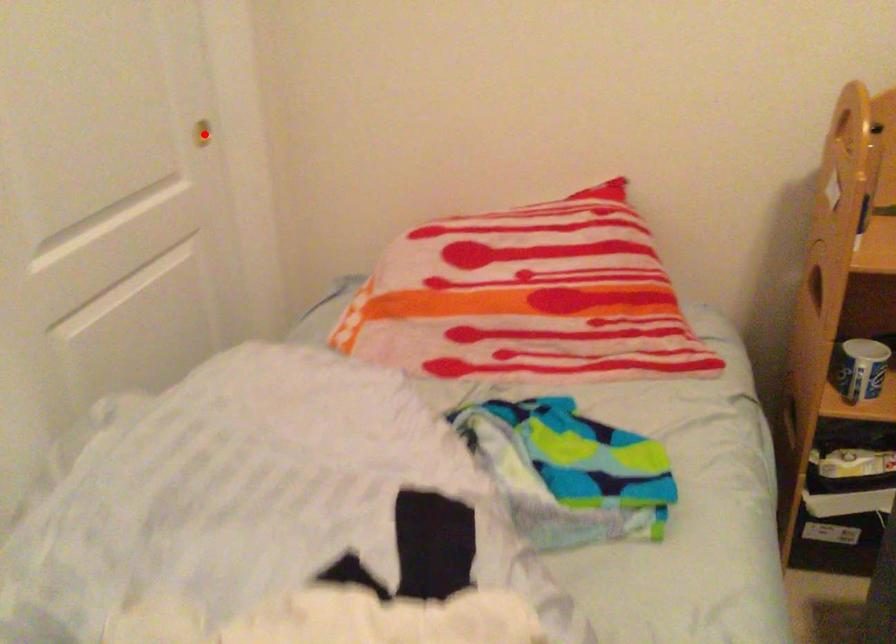
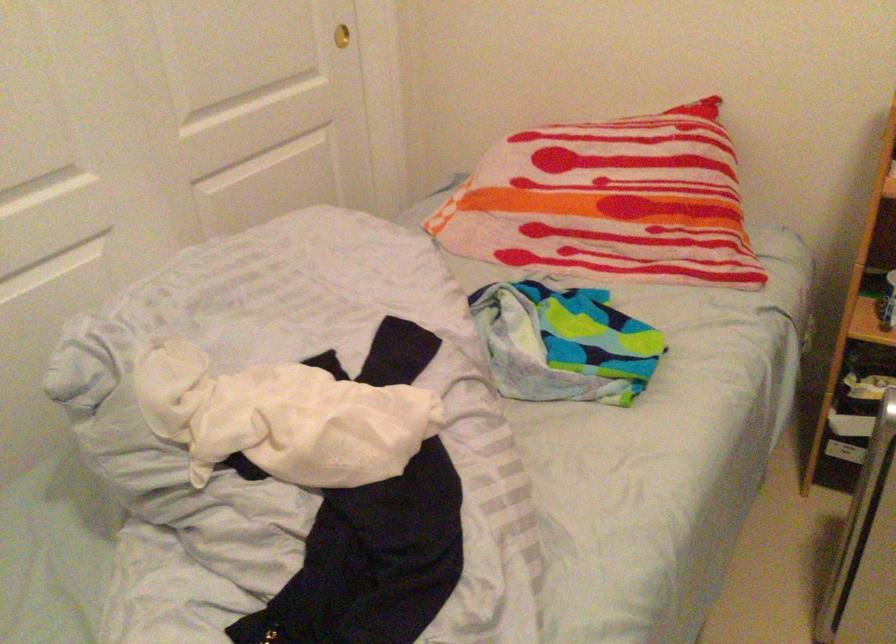
Find the pixel in the second image that matches the highlighted location in the first image.

(340, 35)